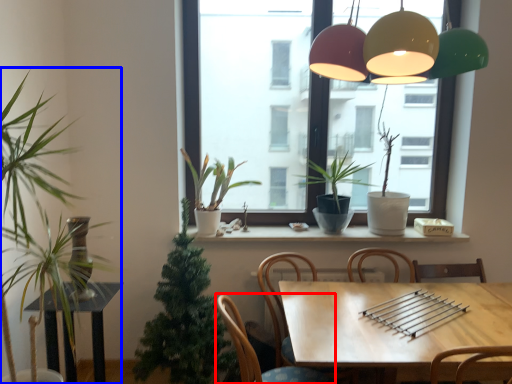
Question: Which object is further to the camera taking this photo, chair (highlighted by a red box) or houseplant (highlighted by a blue box)?

Choices:
 (A) chair
 (B) houseplant

Answer: (A)